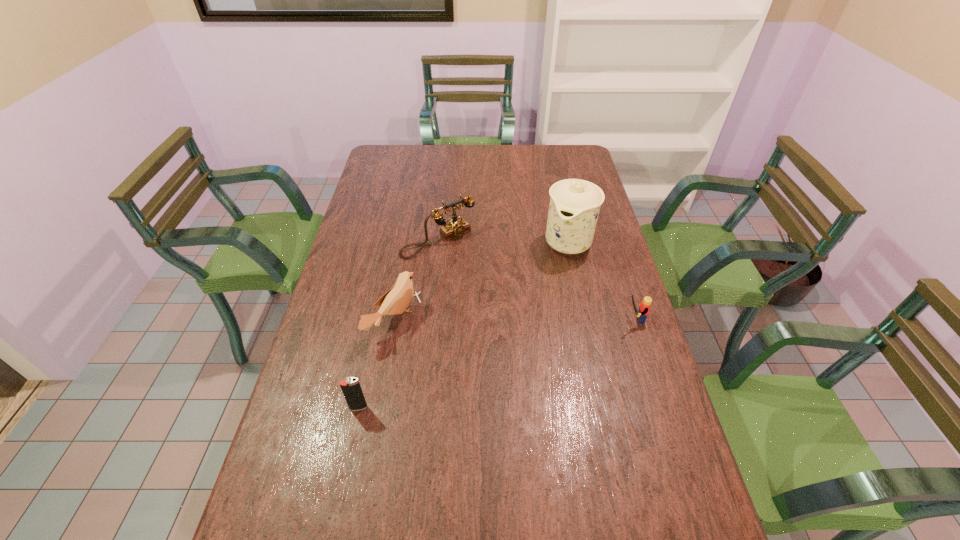
Identify the location of vacant space on the desktop that is between the nearest object and the rightmost object and is positioned on the front-facing side of the telephone. (540, 349).

You are a GUI agent. You are given a task and a screenshot of the screen. Output one action in this format:
    pyautogui.click(x=<x>, y=<y>)
    Task: Click on the vacant space on the desktop that is between the nearest object and the Lego and is positioned on the spout of the tallest object
    The width and height of the screenshot is (960, 540).
    Given the screenshot: What is the action you would take?
    pyautogui.click(x=502, y=361)

The image size is (960, 540). Find the location of `free space on the desktop that is between the nearest object and the Lego and is positioned at the beak of the bird`. free space on the desktop that is between the nearest object and the Lego and is positioned at the beak of the bird is located at coordinates (486, 366).